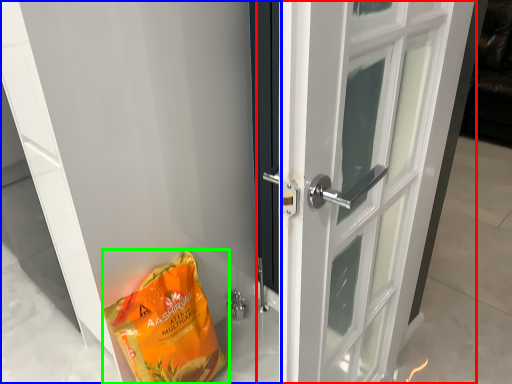
Question: Based on their relative distances, which object is nearer to door (highlighted by a red box)? Choose from door (highlighted by a blue box) and grocery bag (highlighted by a green box).

Choices:
 (A) door
 (B) grocery bag

Answer: (A)